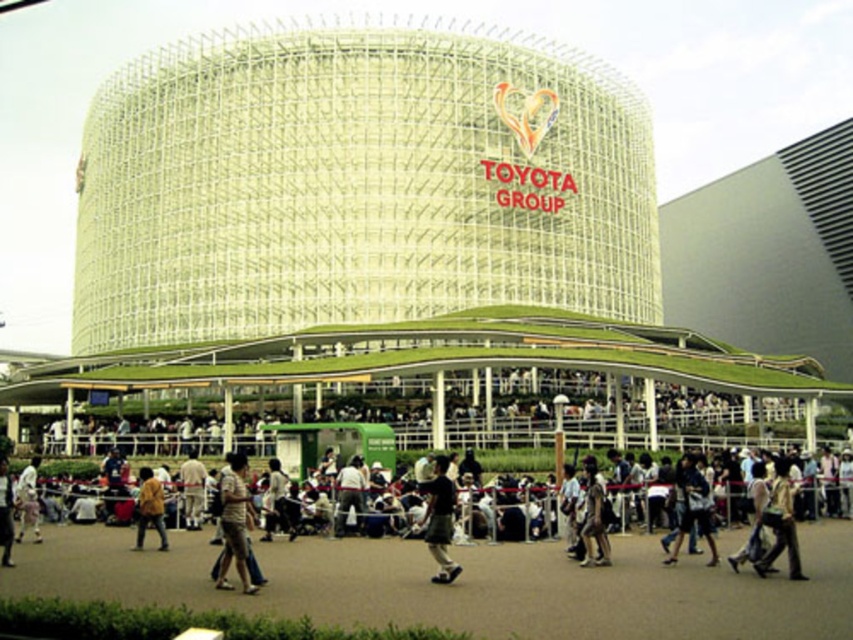
You are a fashion designer observing two shirts in a photo of a modern building with a dome shape and green roof. The shirts are the light brown fabric shirt at center and the white cotton shirt at lower left. Which shirt is taller?

The light brown fabric shirt at center is taller than the white cotton shirt at lower left according to the description.